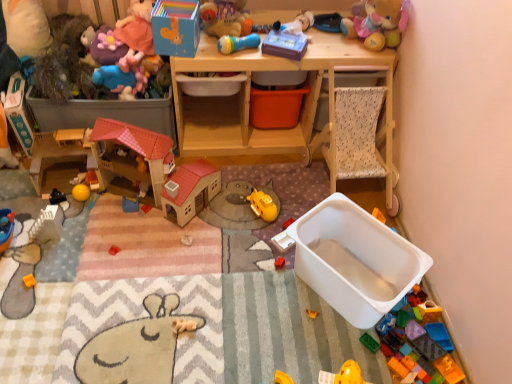
Identify the location of free space to the left of yellow matte submarine at center, marked as the 9th toy in a left-to-right arrangement. [226, 212].